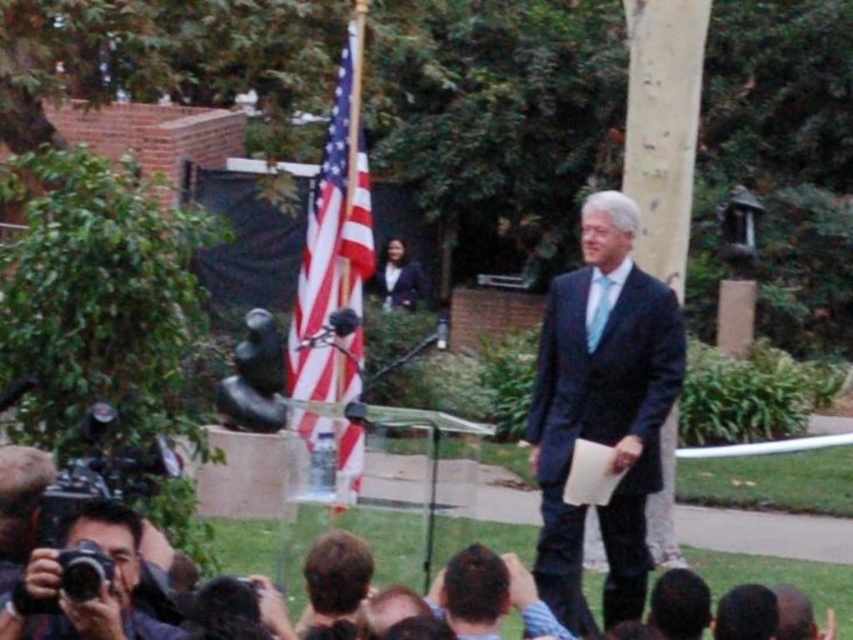
Measure the distance between dark blue suit at center and light blue silk tie at center.

They are 11.31 inches apart.

This screenshot has height=640, width=853. What do you see at coordinates (602, 412) in the screenshot?
I see `dark blue suit at center` at bounding box center [602, 412].

Locate an element on the screen. dark blue suit at center is located at coordinates (602, 412).

Between point (773, 580) and point (27, 576), which one is positioned in front?

Point (27, 576)

What do you see at coordinates (780, 579) in the screenshot?
I see `dark hair human heads at lower center` at bounding box center [780, 579].

Is point (757, 524) closer to camera compared to point (107, 520)?

No, it is not.

The image size is (853, 640). Find the location of `dark hair human heads at lower center`. dark hair human heads at lower center is located at coordinates (780, 579).

Is dark blue suit at center shorter than matte black camera at lower left?

No.

Is dark blue suit at center smaller than matte black camera at lower left?

No, dark blue suit at center is not smaller than matte black camera at lower left.

Where is `dark blue suit at center`? This screenshot has width=853, height=640. dark blue suit at center is located at coordinates (602, 412).